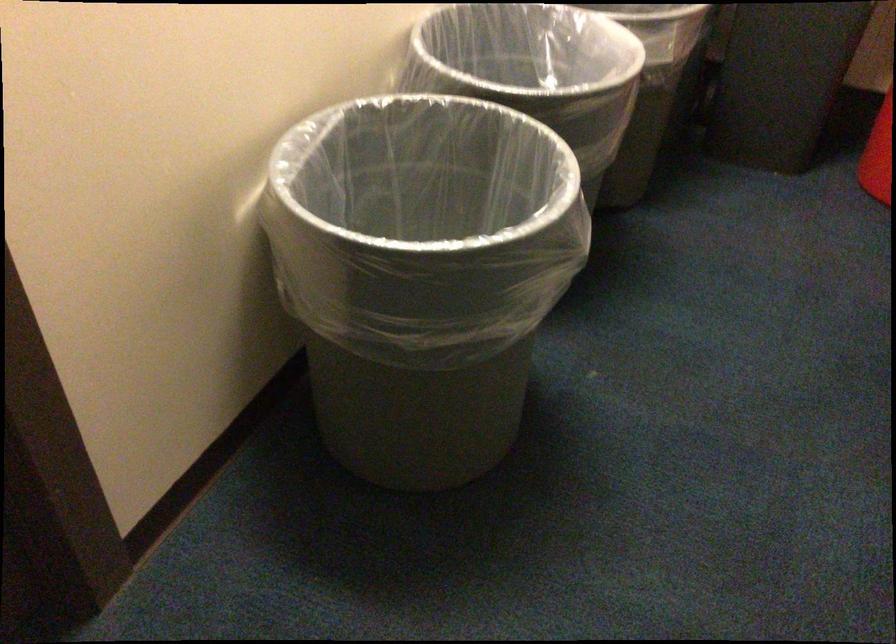
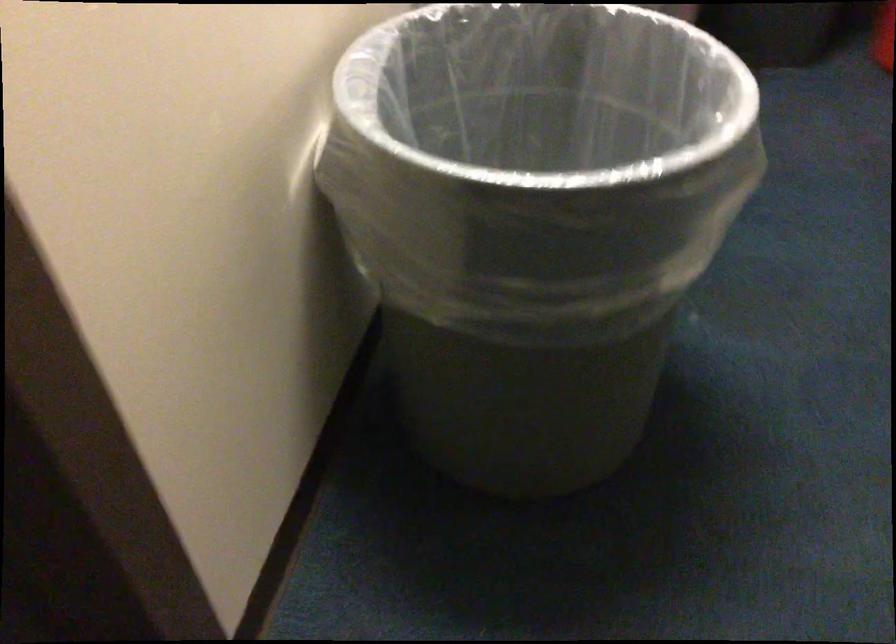
Question: I am providing you with two images of the same scene from different viewpoints. Please identify which objects are invisible in image2.

Choices:
 (A) plastic trash liner
 (B) piano pedal
 (C) small trash can
 (D) gray trash can

Answer: (D)